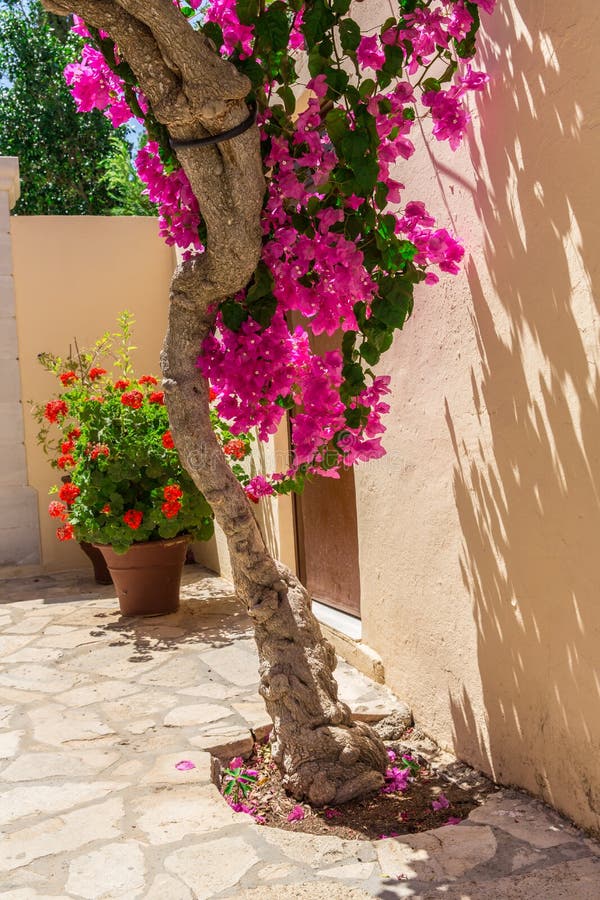
Find the location of a particular element. The image size is (600, 900). wall is located at coordinates (65, 253).